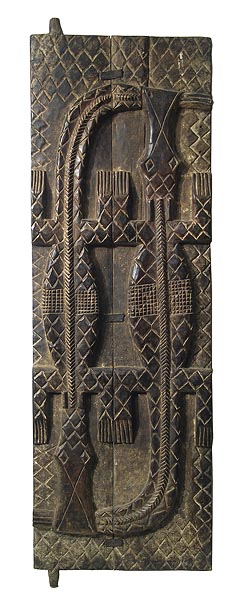
Find the location of a particular element. This screenshot has width=241, height=600. door is located at coordinates (118, 296).